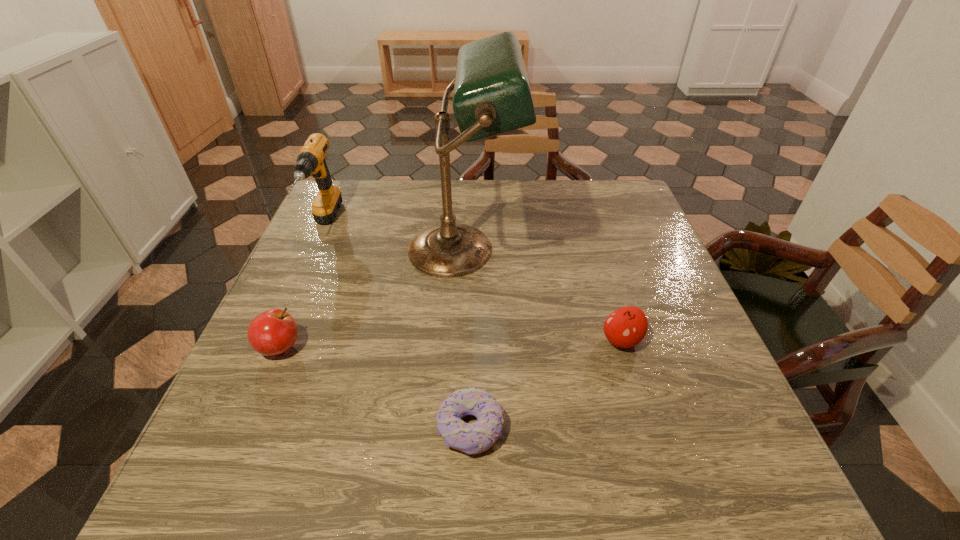
In order to click on vacant space at the left edge in this screenshot , I will do `click(337, 271)`.

In the image, there is a desktop. Where is `vacant space at the right edge`? The height and width of the screenshot is (540, 960). vacant space at the right edge is located at coordinates (636, 276).

The width and height of the screenshot is (960, 540). In order to click on vacant point at the far left corner in this screenshot , I will do `click(367, 183)`.

Find the location of a particular element. free spot between the second tallest object and the tallest object is located at coordinates (394, 238).

In order to click on free space that is in between the table lamp and the left apple in this screenshot , I will do `click(372, 299)`.

Where is `free space between the right apple and the table lamp`? This screenshot has width=960, height=540. free space between the right apple and the table lamp is located at coordinates (542, 295).

The width and height of the screenshot is (960, 540). Find the location of `free space between the tallest object and the right apple`. free space between the tallest object and the right apple is located at coordinates (x=542, y=295).

You are a GUI agent. You are given a task and a screenshot of the screen. Output one action in this format:
    pyautogui.click(x=<x>, y=<y>)
    Task: Click on the empty location between the tallest object and the second tallest object
    The image size is (960, 540).
    Given the screenshot: What is the action you would take?
    pyautogui.click(x=394, y=238)

At what (x,y) coordinates should I click in order to perform the action: click on free space between the nearest object and the right apple. Please return your answer as a coordinate pair (x, y). This screenshot has height=540, width=960. Looking at the image, I should click on (546, 384).

Locate an element on the screen. This screenshot has width=960, height=540. free space between the left apple and the table lamp is located at coordinates [372, 299].